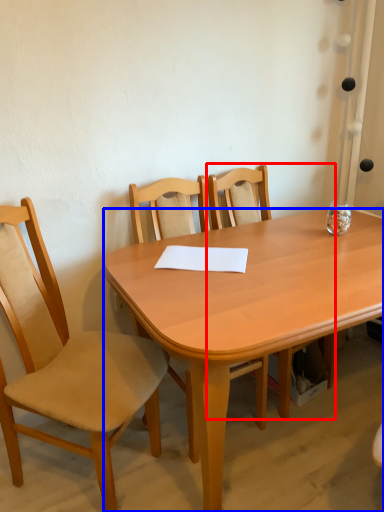
Question: Among these objects, which one is farthest to the camera, chair (highlighted by a red box) or desk (highlighted by a blue box)?

Choices:
 (A) chair
 (B) desk

Answer: (A)